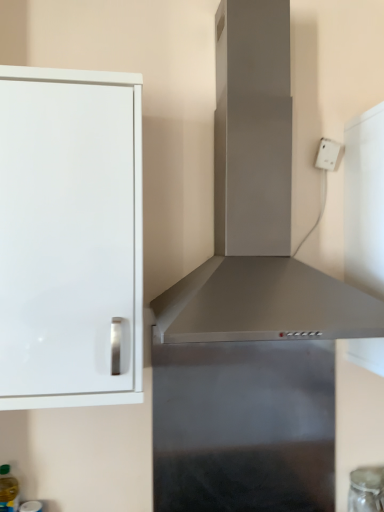
Question: Can you confirm if translucent plastic bottle at lower left is taller than transparent glass jar at lower right?

Choices:
 (A) no
 (B) yes

Answer: (B)

Question: Is translucent plastic bottle at lower left far away from transparent glass jar at lower right?

Choices:
 (A) no
 (B) yes

Answer: (B)

Question: Considering the relative positions of translucent plastic bottle at lower left and transparent glass jar at lower right in the image provided, is translucent plastic bottle at lower left behind transparent glass jar at lower right?

Choices:
 (A) no
 (B) yes

Answer: (A)

Question: Can you confirm if translucent plastic bottle at lower left is smaller than transparent glass jar at lower right?

Choices:
 (A) no
 (B) yes

Answer: (B)

Question: From a real-world perspective, is translucent plastic bottle at lower left on transparent glass jar at lower right?

Choices:
 (A) no
 (B) yes

Answer: (B)

Question: Relative to translucent plastic bottle at lower left, is satin silver vent at center in front or behind?

Choices:
 (A) front
 (B) behind

Answer: (A)

Question: Looking at their shapes, would you say satin silver vent at center is wider or thinner than translucent plastic bottle at lower left?

Choices:
 (A) wide
 (B) thin

Answer: (A)

Question: Based on their sizes in the image, would you say satin silver vent at center is bigger or smaller than translucent plastic bottle at lower left?

Choices:
 (A) big
 (B) small

Answer: (A)

Question: Does point (379, 31) appear closer or farther from the camera than point (1, 468)?

Choices:
 (A) closer
 (B) farther

Answer: (B)

Question: Is satin silver vent at center situated inside transparent glass jar at lower right or outside?

Choices:
 (A) inside
 (B) outside

Answer: (B)

Question: From the image's perspective, relative to transparent glass jar at lower right, is satin silver vent at center above or below?

Choices:
 (A) below
 (B) above

Answer: (B)

Question: From a real-world perspective, relative to transparent glass jar at lower right, is satin silver vent at center vertically above or below?

Choices:
 (A) above
 (B) below

Answer: (A)

Question: Is satin silver vent at center wider or thinner than transparent glass jar at lower right?

Choices:
 (A) wide
 (B) thin

Answer: (A)

Question: From a real-world perspective, is translucent plastic bottle at lower left above or below white glossy cabinet at left?

Choices:
 (A) above
 (B) below

Answer: (B)

Question: From their relative heights in the image, would you say translucent plastic bottle at lower left is taller or shorter than white glossy cabinet at left?

Choices:
 (A) tall
 (B) short

Answer: (B)